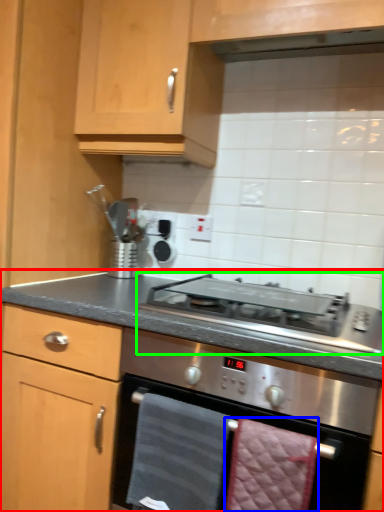
Question: Which object is positioned closest to countertop (highlighted by a red box)? Select from hand towel (highlighted by a blue box) and gas stove (highlighted by a green box).

Choices:
 (A) hand towel
 (B) gas stove

Answer: (B)